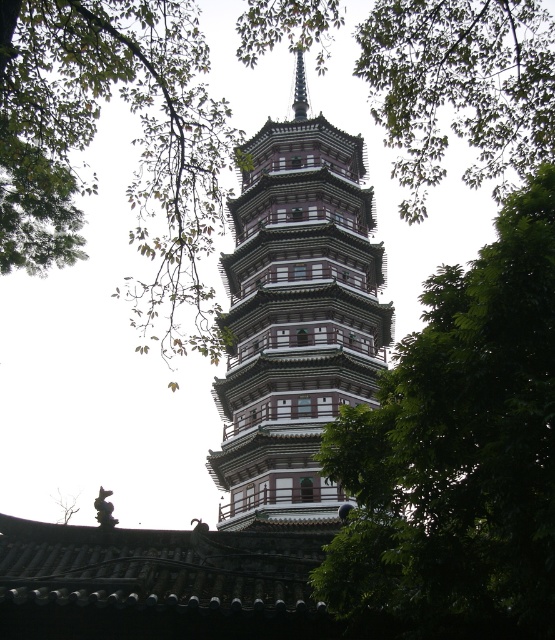
Question: Is green leafy tree at center in front of white wood tower at center?

Choices:
 (A) yes
 (B) no

Answer: (A)

Question: Is green leafy tree at center positioned at the back of white wood tower at center?

Choices:
 (A) yes
 (B) no

Answer: (B)

Question: Which point is farther to the camera?

Choices:
 (A) white wood tower at center
 (B) green leafy tree at center

Answer: (A)

Question: Can you confirm if green leafy tree at center is wider than white wood tower at center?

Choices:
 (A) no
 (B) yes

Answer: (A)

Question: Among these points, which one is farthest from the camera?

Choices:
 (A) (552, 557)
 (B) (301, 456)

Answer: (B)